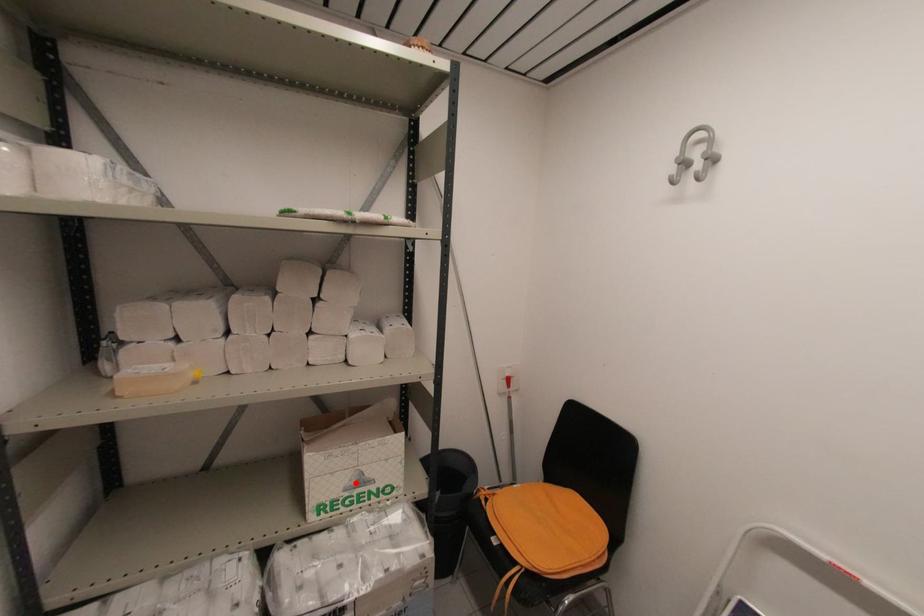
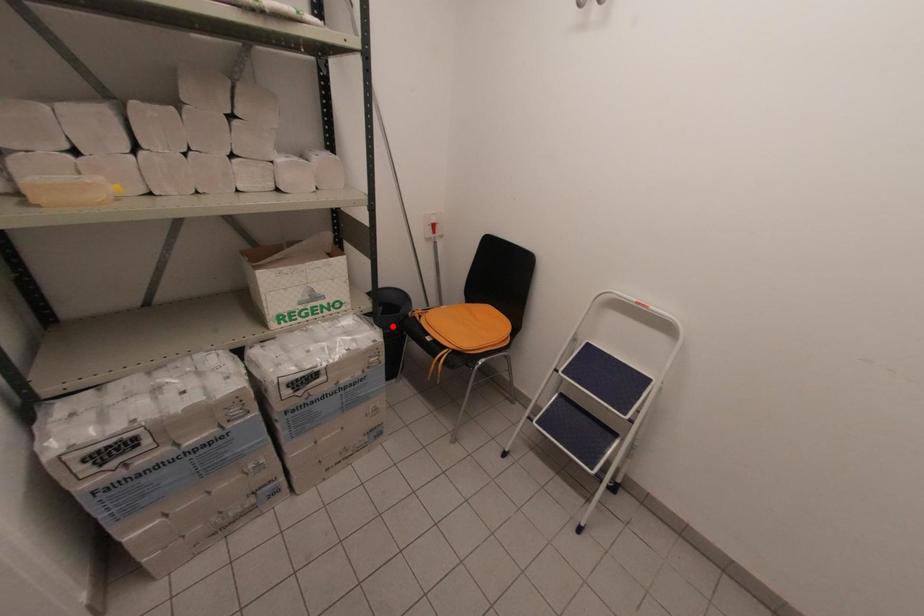
I am providing you with two images of the same scene from different viewpoints. A red point is marked on the first image and another point is marked on the second image. Is the marked point in image1 the same physical position as the marked point in image2?

No